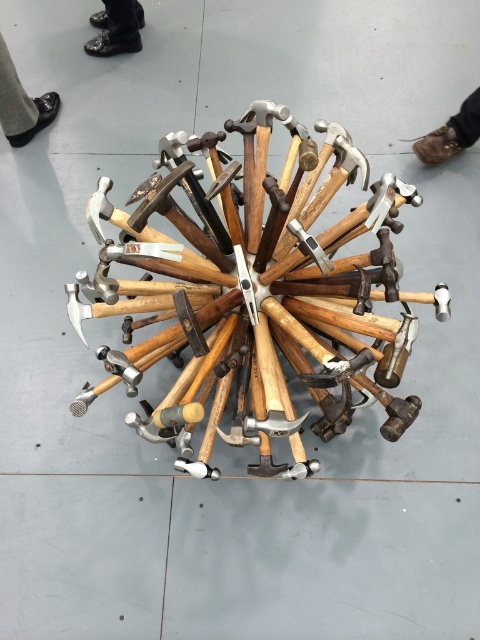
Consider the image. You are standing in the center of the hammer arrangement and want to move towards the shiny leather shoes at upper left and brown leather shoe at upper right. Which direction should you walk to reach both shoes without crossing the hammer handles?

To reach both the shiny leather shoes at upper left and the brown leather shoe at upper right without crossing the hammer handles, you should walk towards the upper left direction first to reach the shiny leather shoes at upper left, then move towards the upper right direction to reach the brown leather shoe at upper right, as the handles extend radially outward from the center, creating pathways between them.

You are a delivery person carrying a box that is 1.5 meters long. You need to place it between the wooden hammer at center and the shiny leather shoes at upper left. Is there enough space for the box to fit horizontally?

The distance between the wooden hammer at center and the shiny leather shoes at upper left is 1.39 meters. Since the box is 1.5 meters long, it is slightly too long to fit in the available space.